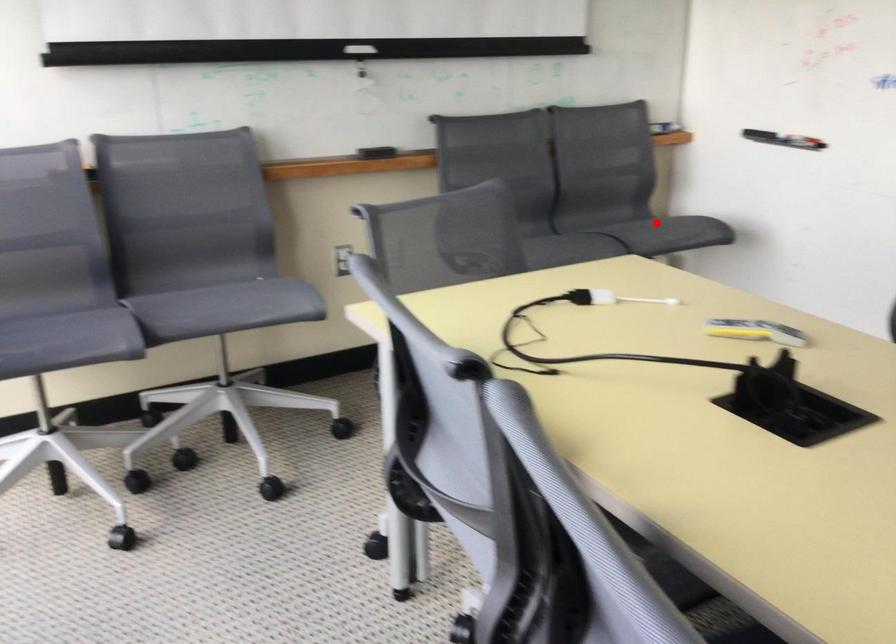
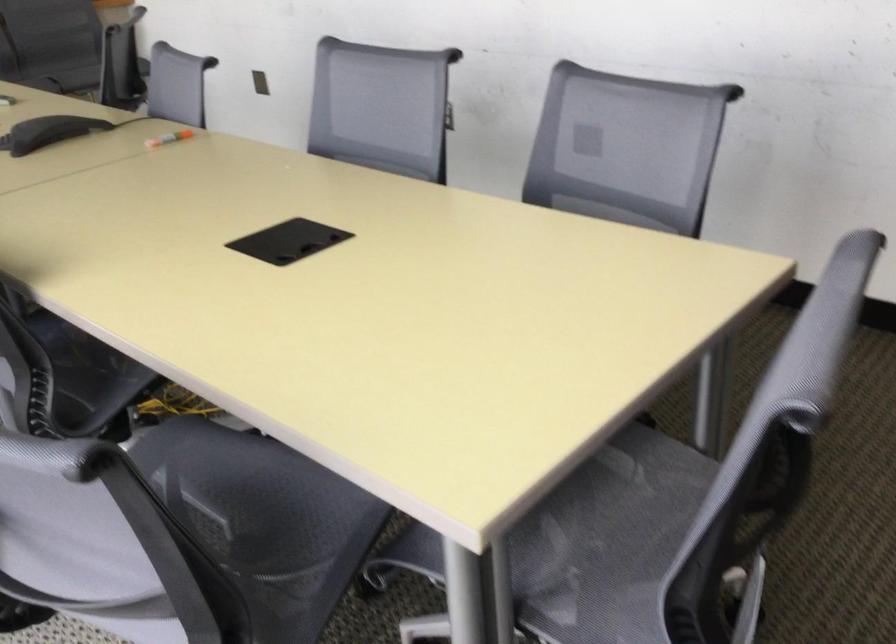
Question: I am providing you with two images of the same scene from different viewpoints. A red point is marked on the first image. Is the red point's position out of view in image 2?

Choices:
 (A) Yes
 (B) No

Answer: (A)